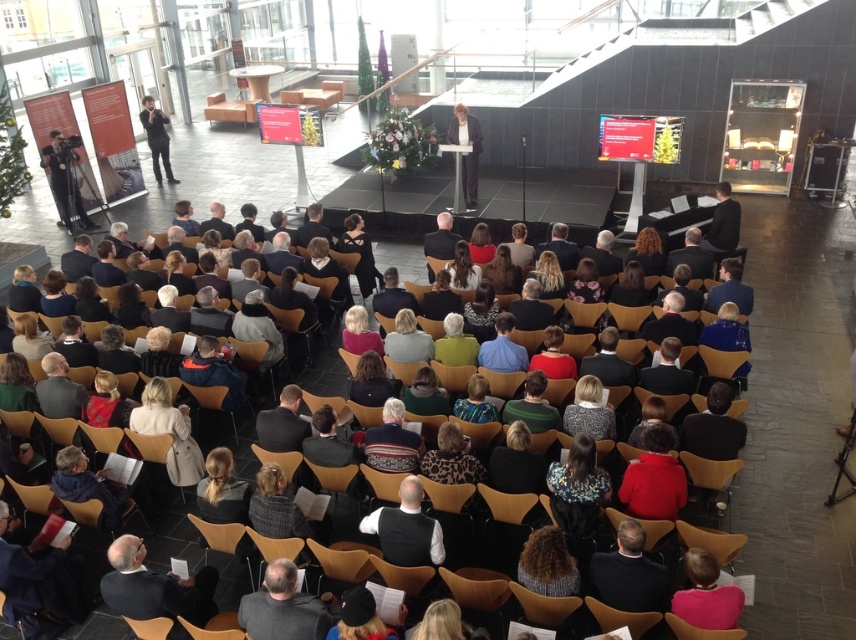
You are a photographer positioned at the back of the auditorium. You need to capture a photo that includes both the dark gray suit at lower center and the black vest at center. Based on their positions, which one will appear closer to the bottom of the photo?

The dark gray suit at lower center will appear closer to the bottom of the photo because it is positioned below the black vest at center.

You are an event organizer who needs to seat two VIP guests. You have two seats available at the front row. One seat is next to the dark gray suit at lower center and the other is next to the black vest at center. Which seat would require a narrower space due to the attendee next to them?

The seat next to the dark gray suit at lower center requires a narrower space because the dark gray suit at lower center has a smaller width compared to the black vest at center.

You are standing at the back of the auditorium and want to take a photo of the stage. There are two points of interest marked in the image. One is at point coordinates point (625, 596) and the other at point coordinates point (545, 355). Which point is closer to you when taking the photo?

Point (625, 596) is closer to the camera than point (545, 355), so it is closer to you when taking the photo.